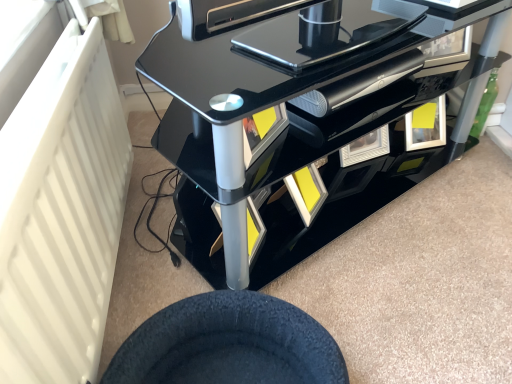
Where is `vacant space in between glossy black entertainment unit at center and black fuzzy wheel at lower center`? vacant space in between glossy black entertainment unit at center and black fuzzy wheel at lower center is located at coordinates (335, 267).